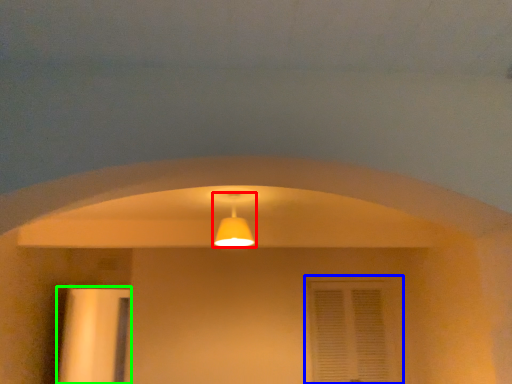
Question: Which object is the farthest from lamp (highlighted by a red box)? Choose among these: window (highlighted by a blue box) or door (highlighted by a green box).

Choices:
 (A) window
 (B) door

Answer: (B)